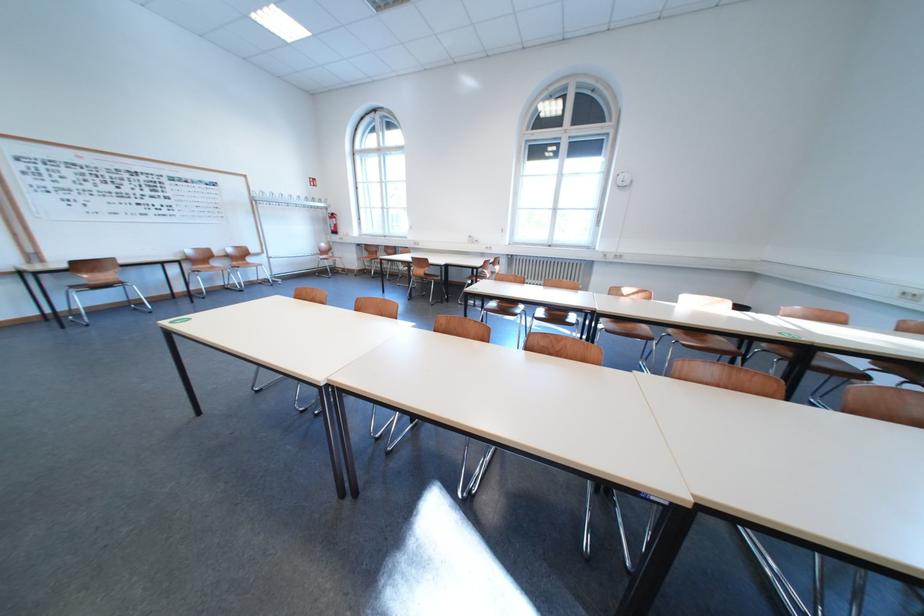
Find the location of a particular element. white window handle is located at coordinates (554, 207).